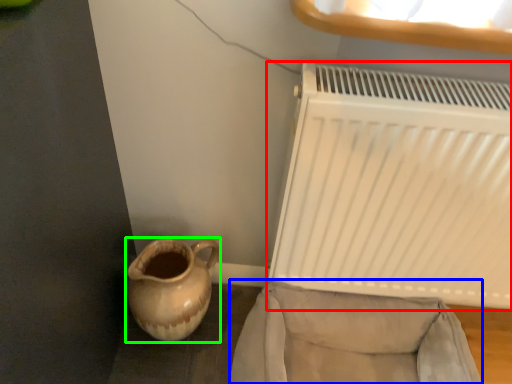
Question: Estimate the real-world distances between objects in this image. Which object is closer to radiator (highlighted by a red box), armchair (highlighted by a blue box) or jug (highlighted by a green box)?

Choices:
 (A) armchair
 (B) jug

Answer: (A)